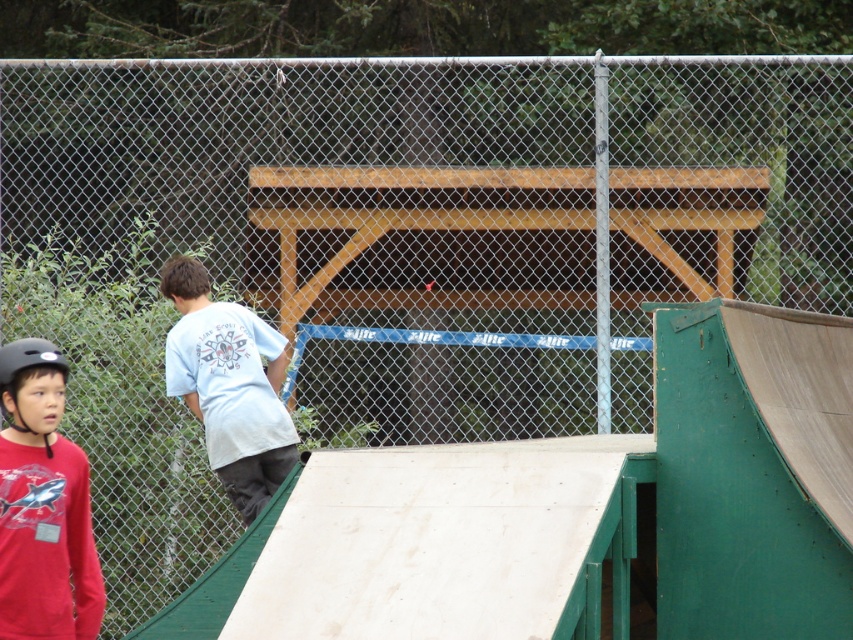
Question: Can you confirm if red matte shirt at left is positioned above white cotton shirt at center?

Choices:
 (A) yes
 (B) no

Answer: (B)

Question: Is red matte shirt at left thinner than matte black helmet at left?

Choices:
 (A) no
 (B) yes

Answer: (A)

Question: Which of these objects is positioned closest to the red matte shirt at left?

Choices:
 (A) white cotton shirt at center
 (B) matte black helmet at left

Answer: (B)

Question: Does white cotton shirt at center appear over matte black helmet at left?

Choices:
 (A) no
 (B) yes

Answer: (A)

Question: Which point is closer to the camera taking this photo?

Choices:
 (A) (22, 344)
 (B) (184, 348)
 (C) (59, 436)

Answer: (A)

Question: Which object appears farthest from the camera in this image?

Choices:
 (A) matte black helmet at left
 (B) white cotton shirt at center

Answer: (B)